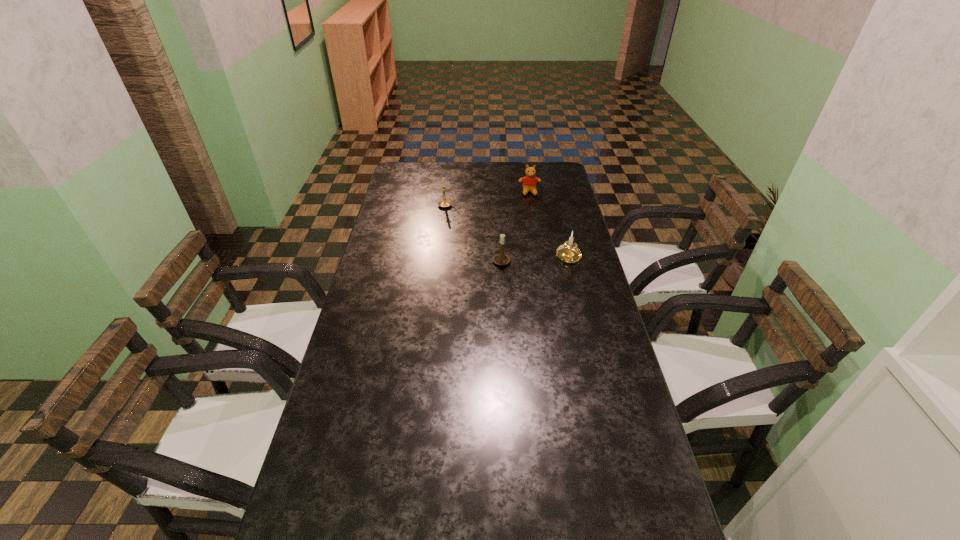
Where is `teddy bear at the right edge`? Image resolution: width=960 pixels, height=540 pixels. teddy bear at the right edge is located at coordinates (529, 182).

The height and width of the screenshot is (540, 960). In order to click on candle holder present at the right edge in this screenshot , I will do (x=568, y=252).

I want to click on vacant space at the far edge, so click(438, 164).

Identify the location of vacant space at the left edge of the desktop. The image size is (960, 540). (367, 303).

At what (x,y) coordinates should I click in order to perform the action: click on vacant area at the right edge. Please return your answer as a coordinate pair (x, y). The width and height of the screenshot is (960, 540). Looking at the image, I should click on (555, 289).

Locate an element on the screen. This screenshot has height=540, width=960. empty location between the third object from left to right and the rightmost candle holder is located at coordinates (549, 225).

You are a GUI agent. You are given a task and a screenshot of the screen. Output one action in this format:
    pyautogui.click(x=<x>, y=<y>)
    Task: Click on the empty location between the rightmost object and the second farthest object
    
    Given the screenshot: What is the action you would take?
    pyautogui.click(x=508, y=231)

The image size is (960, 540). Identify the location of vacant area between the second candle holder from right to left and the rightmost object. (x=536, y=260).

This screenshot has height=540, width=960. What are the coordinates of `vacant space that is in between the rightmost candle holder and the leftmost object` in the screenshot? It's located at click(508, 231).

Identify which object is the second closest to the farthest candle holder. Please provide its 2D coordinates. Your answer should be formatted as a tuple, i.e. [(x, y)], where the tuple contains the x and y coordinates of a point satisfying the conditions above.

[(500, 259)]